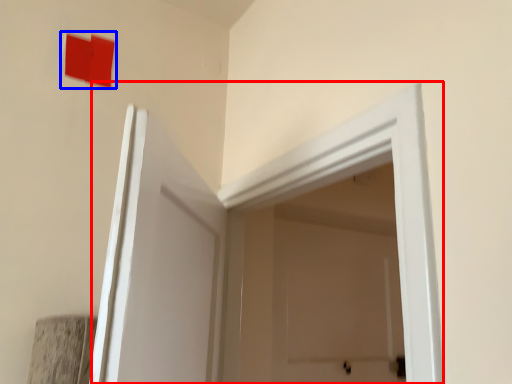
Question: Which object appears closest to the camera in this image, door (highlighted by a red box) or square (highlighted by a blue box)?

Choices:
 (A) door
 (B) square

Answer: (A)